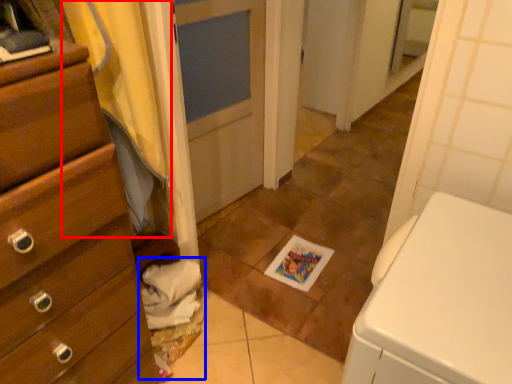
Question: Which point is closer to the camera, curtain (highlighted by a red box) or laundry (highlighted by a blue box)?

Choices:
 (A) curtain
 (B) laundry

Answer: (A)